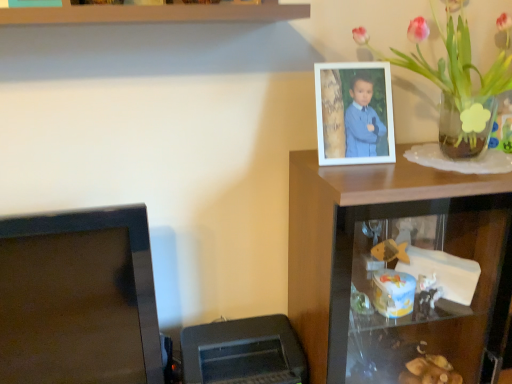
Question: Is wooden shelf at upper right to the left of satin black monitor at lower left from the viewer's perspective?

Choices:
 (A) no
 (B) yes

Answer: (A)

Question: From the image's perspective, is wooden shelf at upper right on top of satin black monitor at lower left?

Choices:
 (A) no
 (B) yes

Answer: (A)

Question: Does wooden shelf at upper right come behind satin black monitor at lower left?

Choices:
 (A) no
 (B) yes

Answer: (B)

Question: Can you confirm if wooden shelf at upper right is taller than satin black monitor at lower left?

Choices:
 (A) no
 (B) yes

Answer: (B)

Question: Is wooden shelf at upper right thinner than satin black monitor at lower left?

Choices:
 (A) no
 (B) yes

Answer: (A)

Question: Considering the relative positions of white matte picture frame at upper right and wooden shelf at upper right in the image provided, is white matte picture frame at upper right to the left or to the right of wooden shelf at upper right?

Choices:
 (A) right
 (B) left

Answer: (B)

Question: Is white matte picture frame at upper right inside the boundaries of wooden shelf at upper right, or outside?

Choices:
 (A) outside
 (B) inside

Answer: (A)

Question: Is white matte picture frame at upper right wider or thinner than wooden shelf at upper right?

Choices:
 (A) wide
 (B) thin

Answer: (B)

Question: In terms of size, does white matte picture frame at upper right appear bigger or smaller than wooden shelf at upper right?

Choices:
 (A) small
 (B) big

Answer: (A)

Question: Does point (332, 102) appear closer or farther from the camera than point (463, 21)?

Choices:
 (A) farther
 (B) closer

Answer: (B)

Question: Would you say white matte picture frame at upper right is to the left or to the right of translucent glass vase at upper right in the picture?

Choices:
 (A) left
 (B) right

Answer: (A)

Question: Considering the positions of white matte picture frame at upper right and translucent glass vase at upper right in the image, is white matte picture frame at upper right bigger or smaller than translucent glass vase at upper right?

Choices:
 (A) big
 (B) small

Answer: (B)

Question: In terms of width, does white matte picture frame at upper right look wider or thinner when compared to translucent glass vase at upper right?

Choices:
 (A) wide
 (B) thin

Answer: (B)

Question: From the image's perspective, is white matte picture frame at upper right above or below black plastic printer at lower left?

Choices:
 (A) below
 (B) above

Answer: (B)

Question: From a real-world perspective, is white matte picture frame at upper right physically located above or below black plastic printer at lower left?

Choices:
 (A) above
 (B) below

Answer: (A)